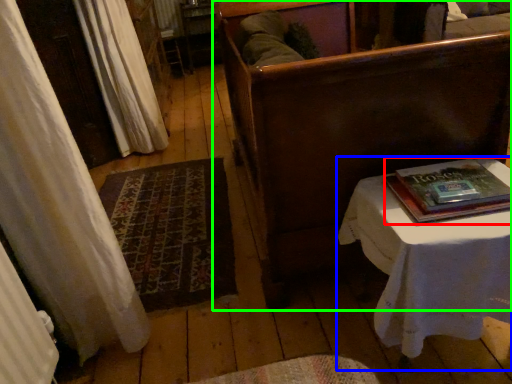
Question: Which object is the farthest from paperback book (highlighted by a red box)? Choose among these: table (highlighted by a blue box) or furniture (highlighted by a green box).

Choices:
 (A) table
 (B) furniture

Answer: (B)